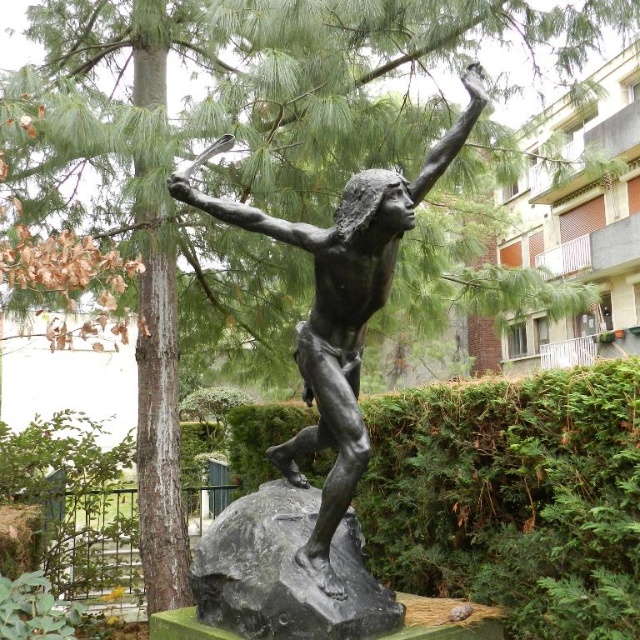
Is bronze statue at center below black polished stone at center?

Actually, bronze statue at center is above black polished stone at center.

Is point (314, 428) farther from viewer compared to point (230, 580)?

Yes.

Locate an element on the screen. bronze statue at center is located at coordinates (342, 310).